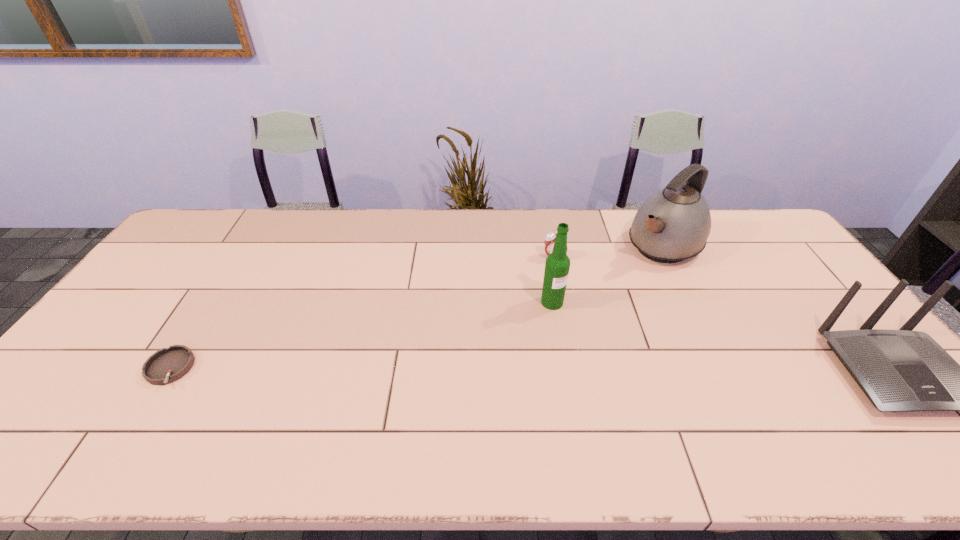
Locate an element on the screen. the shortest object is located at coordinates (167, 365).

Identify the location of the leftmost object. (167, 365).

At what (x,y) coordinates should I click in order to perform the action: click on the third farthest object. Please return your answer as a coordinate pair (x, y). Looking at the image, I should click on (557, 265).

This screenshot has height=540, width=960. In order to click on the second shortest object in this screenshot , I will do `click(550, 237)`.

Locate an element on the screen. kettle is located at coordinates (673, 224).

Find the location of a particular element. The width and height of the screenshot is (960, 540). vacant point located 0.360m on the right of the shortest object is located at coordinates (331, 368).

Identify the location of vacant space located on the label of the third farthest object. (575, 321).

This screenshot has height=540, width=960. In order to click on vacant region located 0.310m on the label of the third farthest object in this screenshot , I will do `click(646, 380)`.

The width and height of the screenshot is (960, 540). In order to click on blank space located 0.340m on the label of the third farthest object in this screenshot , I will do `click(656, 389)`.

Identify the location of vacant space located on the clock face of the alarm clock. The width and height of the screenshot is (960, 540). (555, 282).